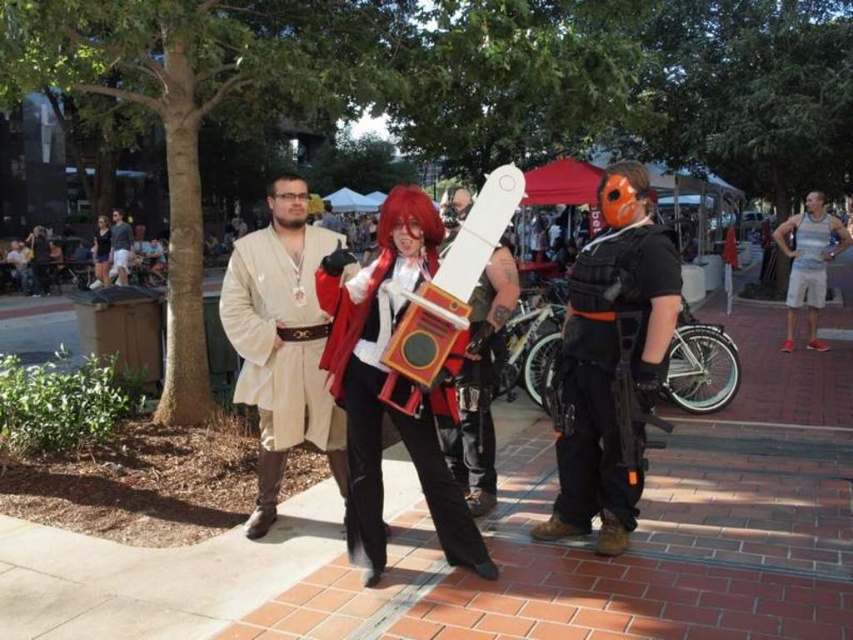
Between matte red and white sword at center and matte black armor at center, which one is positioned lower?

matte black armor at center

Image resolution: width=853 pixels, height=640 pixels. I want to click on matte red and white sword at center, so click(405, 362).

Between matte red and white sword at center and white matte tank top at right, which one appears on the right side from the viewer's perspective?

From the viewer's perspective, white matte tank top at right appears more on the right side.

Does matte red and white sword at center have a lesser height compared to white matte tank top at right?

Indeed, matte red and white sword at center has a lesser height compared to white matte tank top at right.

I want to click on matte red and white sword at center, so click(x=405, y=362).

The width and height of the screenshot is (853, 640). What are the coordinates of `matte red and white sword at center` in the screenshot? It's located at (405, 362).

Is point (706, 582) less distant than point (634, 451)?

Yes, point (706, 582) is in front of point (634, 451).

Consider the image. Can you confirm if brick pavement at center is positioned to the left of black matte tactical vest at center?

Indeed, brick pavement at center is positioned on the left side of black matte tactical vest at center.

What are the coordinates of `brick pavement at center` in the screenshot? It's located at (511, 541).